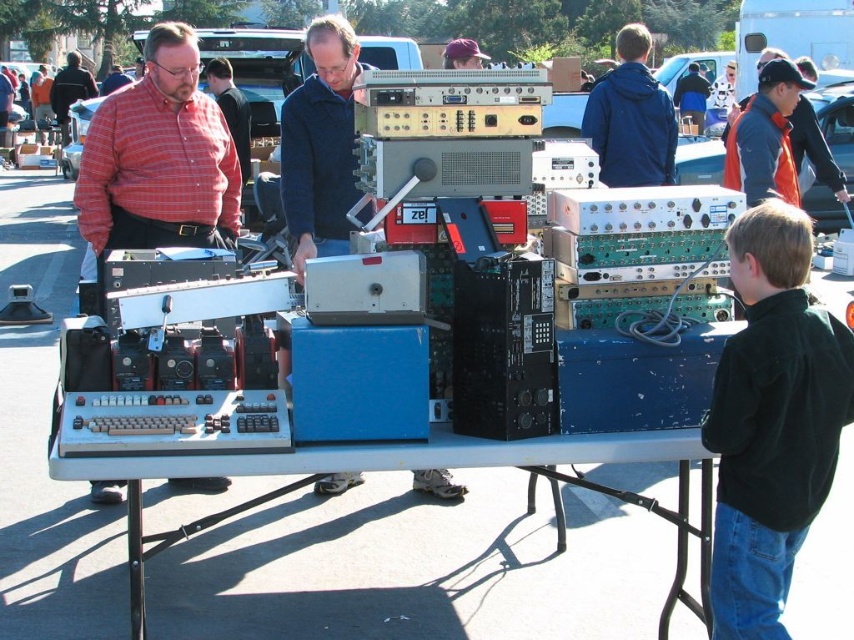
Question: Which object is farther from the camera taking this photo?

Choices:
 (A) matte red shirt at upper left
 (B) black cotton shirt at lower right
 (C) white plastic table at center

Answer: (A)

Question: Can you confirm if black cotton shirt at lower right is positioned below red plaid shirt at left?

Choices:
 (A) yes
 (B) no

Answer: (A)

Question: Which of the following is the farthest from the observer?

Choices:
 (A) matte red shirt at upper left
 (B) white plastic table at center

Answer: (A)

Question: Which point is closer to the camera?

Choices:
 (A) black cotton shirt at lower right
 (B) matte red shirt at upper left

Answer: (A)

Question: Where is blue matte jacket at upper center located in relation to matte red shirt at upper left in the image?

Choices:
 (A) right
 (B) left

Answer: (A)

Question: Does black cotton shirt at lower right have a lesser width compared to matte red shirt at upper left?

Choices:
 (A) yes
 (B) no

Answer: (A)